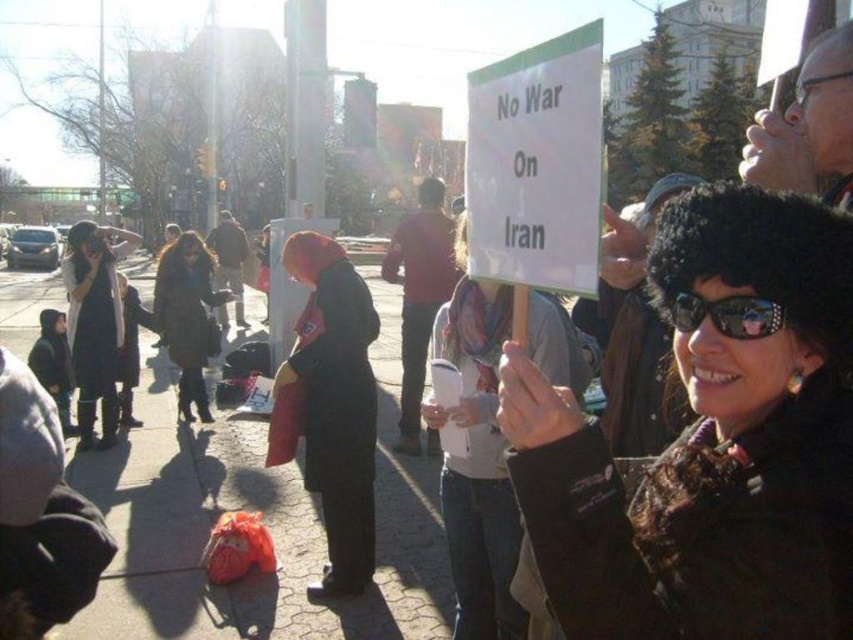
Based on the scene description, can you determine which object is taller between the white paper sign at center and the dark brown leather coat at center?

The white paper sign at center is not as tall as the dark brown leather coat at center, so the dark brown leather coat at center is taller.

You are a photographer trying to capture a clear shot of both the black fur hat at center and the dark brown leather coat at center in the scene. Since you want to ensure both are visible, which object should you focus on first to account for their size difference?

The black fur hat at center occupies less space than the dark brown leather coat at center, so you should focus on the black fur hat at center first to ensure it is clearly visible despite its smaller size.